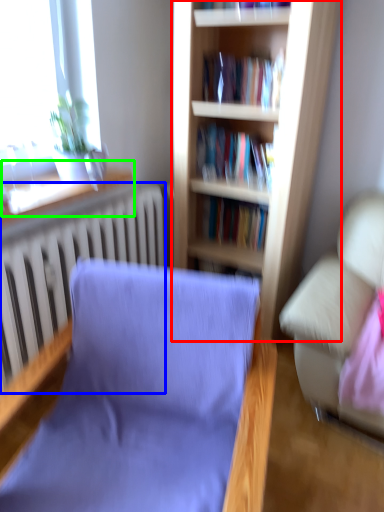
Question: Estimate the real-world distances between objects in this image. Which object is farther from bookcase (highlighted by a red box), radiator (highlighted by a blue box) or window sill (highlighted by a green box)?

Choices:
 (A) radiator
 (B) window sill

Answer: (B)